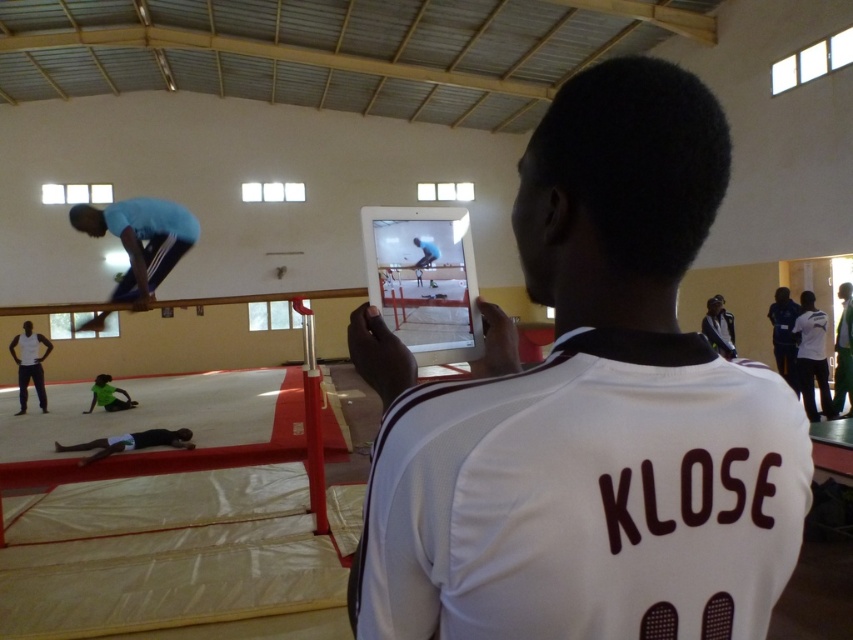
Question: Which object is farther from the camera taking this photo?

Choices:
 (A) blue fabric pants at upper center
 (B) white jersey at center

Answer: (A)

Question: Does white jersey at center have a greater width compared to blue fabric pants at upper center?

Choices:
 (A) no
 (B) yes

Answer: (A)

Question: Which object is farther from the camera taking this photo?

Choices:
 (A) white jersey at center
 (B) blue fabric pants at upper center

Answer: (B)

Question: From the image, what is the correct spatial relationship of white jersey at center in relation to blue fabric pants at upper center?

Choices:
 (A) below
 (B) above

Answer: (A)

Question: Can you confirm if white jersey at center is positioned above blue fabric pants at upper center?

Choices:
 (A) no
 (B) yes

Answer: (A)